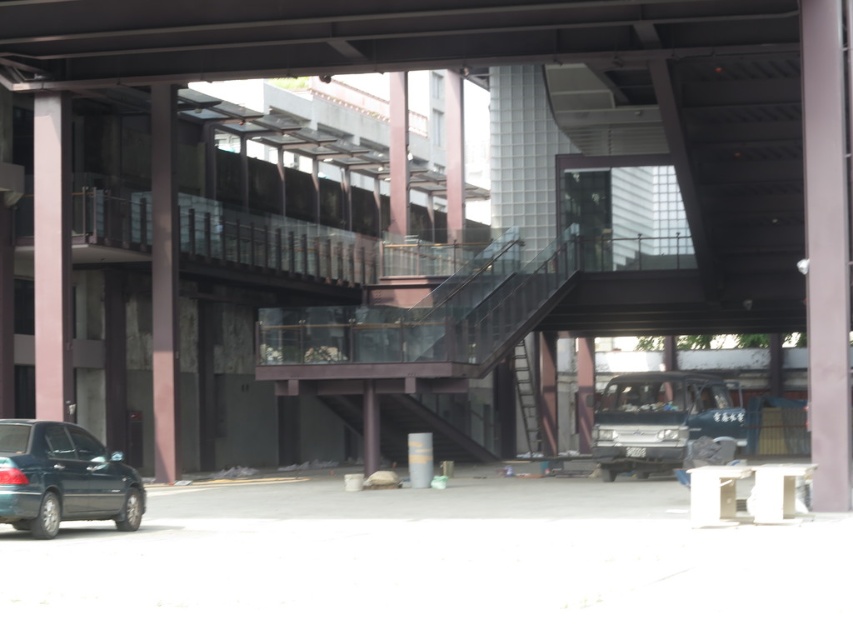
You are a delivery person trying to navigate through the area. You need to pass between the pink matte pillar at left and the metallic staircase at center. Can you fit a standard delivery cart that is 1.2 meters wide through the space between them?

The pink matte pillar at left has a lesser width compared to the metallic staircase at center. Since the pillar is narrower, the space between them may allow the 1.2 meter wide delivery cart to pass, but it would require careful maneuvering due to the pillar being narrower than the staircase.

Consider the image. You are a delivery person trying to reach the entrance of the building. You see the shiny dark blue sedan at lower left and the metallic staircase at center. Which object is closer to you?

The shiny dark blue sedan at lower left is closer to you because it is in front of the metallic staircase at center.

You are standing at the point indicated by point (660, 419) in the image. What vehicle are you directly in front of?

The point (660, 419) indicates dark blue matte van at center, so you are directly in front of the dark blue matte van at center.